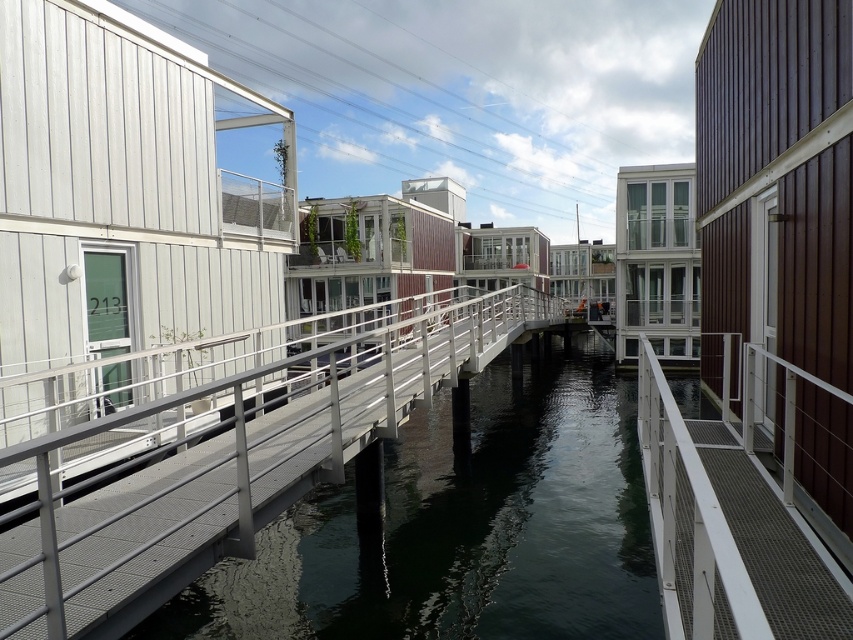
Which is above, transparent glass water at center or metal mesh dock at center?

metal mesh dock at center is above.

Between transparent glass water at center and metal mesh dock at center, which one has less height?

metal mesh dock at center is shorter.

Which is in front, point (503, 412) or point (685, 588)?

Positioned in front is point (685, 588).

Locate an element on the screen. Image resolution: width=853 pixels, height=640 pixels. transparent glass water at center is located at coordinates (462, 529).